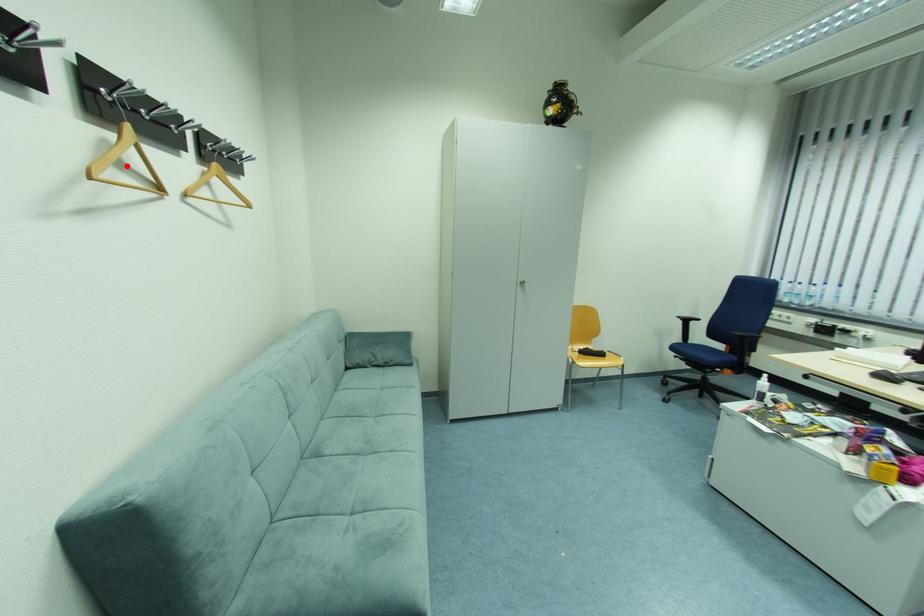
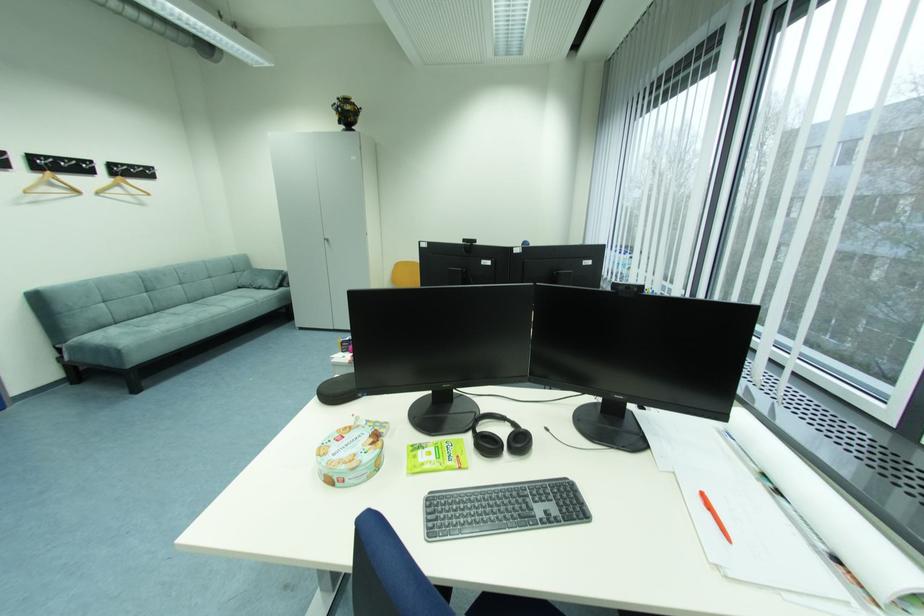
Locate, in the second image, the point that corresponds to the highlighted location in the first image.

(59, 185)